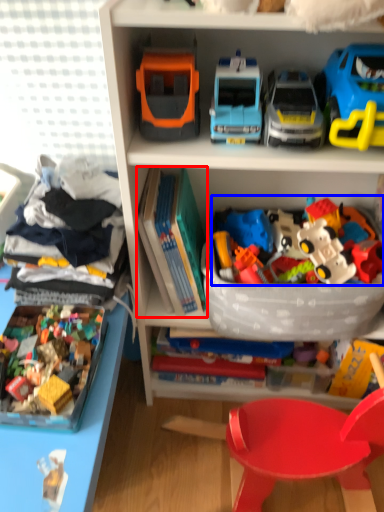
Question: Which point is further to the camera, book (highlighted by a red box) or toy (highlighted by a blue box)?

Choices:
 (A) book
 (B) toy

Answer: (A)